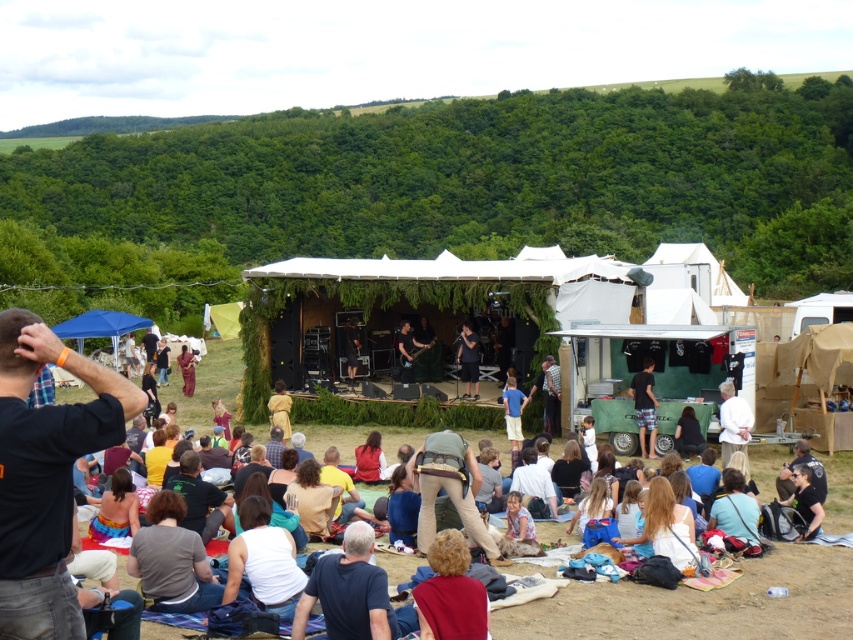
Looking at this image, you are a photographer at the music festival. You want to capture a photo of the dark blue uniform at lower right and the dark brown leather guitar at center. Which object should you focus on first if you want to include both in your shot without moving the camera?

The dark blue uniform at lower right is positioned under the dark brown leather guitar at center, so you should focus on the dark brown leather guitar at center first to ensure both are in frame.

You are a photographer at the music festival. You want to take a photo of the dark blue uniform at lower right and the light blue denim shorts at center. Which object is positioned lower in the image?

The dark blue uniform at lower right is positioned below the light blue denim shorts at center, so it is lower in the image.

You are a photographer at the music festival. You need to capture a photo that includes both the dark blue uniform at lower right and the light blue denim shorts at center. Since you want to ensure both are clearly visible, which object should you focus on first to avoid blurring due to their size difference?

The dark blue uniform at lower right is smaller in width than the light blue denim shorts at center, so you should focus on the dark blue uniform at lower right first to ensure clarity before adjusting for the larger object.